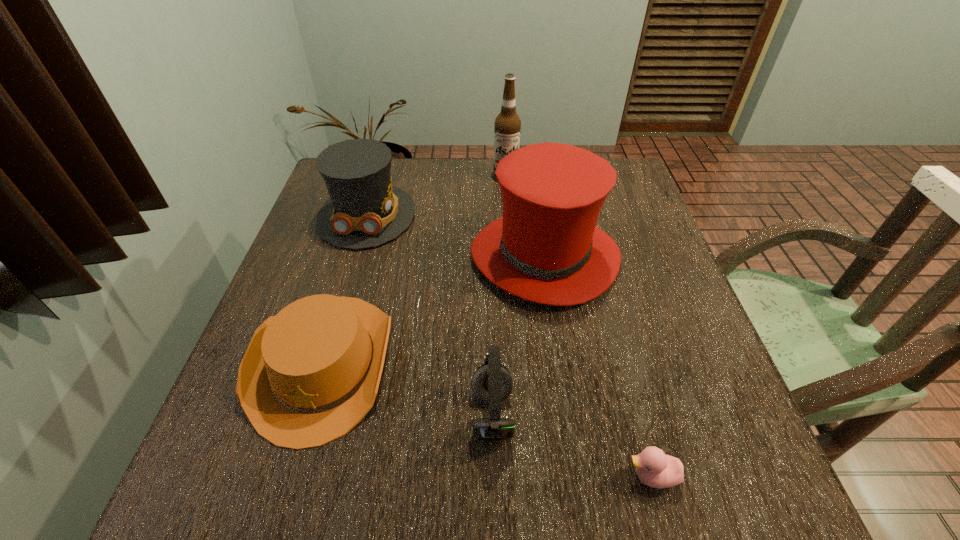
Identify the location of vacant space located on the back of the second tallest object. The height and width of the screenshot is (540, 960). (533, 181).

At what (x,y) coordinates should I click in order to perform the action: click on vacant space located 0.250m with goggles on the front of the shorter dress hat. Please return your answer as a coordinate pair (x, y). Looking at the image, I should click on (332, 332).

Identify the location of free space located 0.250m on the ear cups of the headset. The width and height of the screenshot is (960, 540). [329, 415].

Identify the location of free space located on the ear cups of the headset. Image resolution: width=960 pixels, height=540 pixels. (296, 415).

Identify the location of blank space located on the ear cups of the headset. (290, 415).

Find the location of `vacant region located on the front-facing side of the second shortest object`. vacant region located on the front-facing side of the second shortest object is located at coordinates (289, 481).

Locate an element on the screen. Image resolution: width=960 pixels, height=540 pixels. free spot located on the front-facing side of the shortest object is located at coordinates (487, 476).

At what (x,y) coordinates should I click in order to perform the action: click on free space located on the front-facing side of the shortest object. Please return your answer as a coordinate pair (x, y). Image resolution: width=960 pixels, height=540 pixels. Looking at the image, I should click on (499, 476).

Identify the location of free space located on the front-facing side of the shortest object. This screenshot has height=540, width=960. (393, 476).

Where is `alcohol present at the far edge`? This screenshot has height=540, width=960. alcohol present at the far edge is located at coordinates (507, 127).